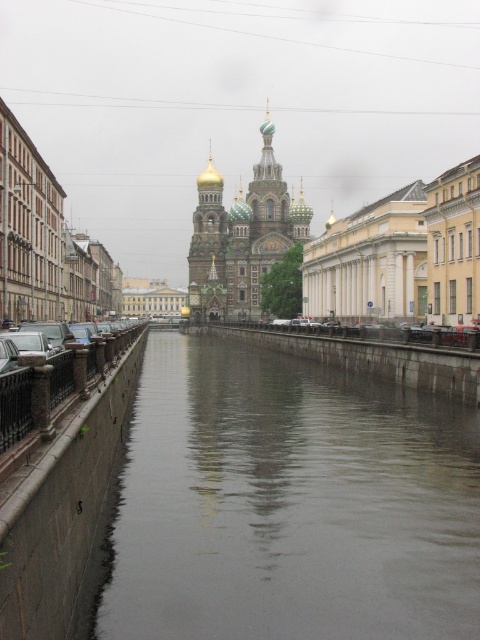
Question: From the image, what is the correct spatial relationship of smooth concrete river at center in relation to golden domed cathedral at center?

Choices:
 (A) left
 (B) right

Answer: (B)

Question: Is smooth concrete river at center to the left of golden domed cathedral at center from the viewer's perspective?

Choices:
 (A) yes
 (B) no

Answer: (B)

Question: Which point is farther to the camera?

Choices:
 (A) golden domed cathedral at center
 (B) smooth concrete river at center

Answer: (A)

Question: Which point appears closest to the camera in this image?

Choices:
 (A) (288, 449)
 (B) (309, 208)

Answer: (A)

Question: Is smooth concrete river at center to the left of golden domed cathedral at center from the viewer's perspective?

Choices:
 (A) no
 (B) yes

Answer: (A)